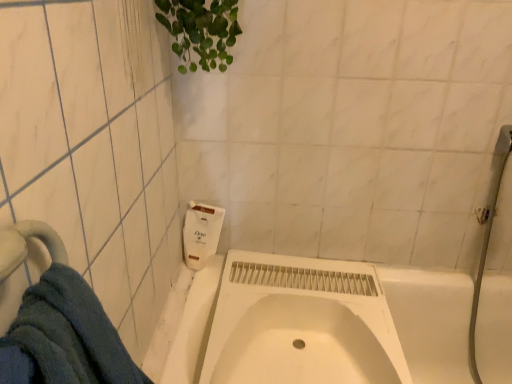
Question: Is white matte soap dispenser at upper center aimed at white matte bathtub at center?

Choices:
 (A) no
 (B) yes

Answer: (A)

Question: Considering the relative sizes of white matte soap dispenser at upper center and white matte bathtub at center in the image provided, is white matte soap dispenser at upper center taller than white matte bathtub at center?

Choices:
 (A) yes
 (B) no

Answer: (B)

Question: Is white matte soap dispenser at upper center completely or partially outside of white matte bathtub at center?

Choices:
 (A) yes
 (B) no

Answer: (A)

Question: From the image's perspective, is white matte soap dispenser at upper center located above white matte bathtub at center?

Choices:
 (A) no
 (B) yes

Answer: (B)

Question: Considering the relative positions of white matte soap dispenser at upper center and white matte bathtub at center in the image provided, is white matte soap dispenser at upper center in front of white matte bathtub at center?

Choices:
 (A) yes
 (B) no

Answer: (B)

Question: Is white matte bathtub at center surrounded by white matte soap dispenser at upper center?

Choices:
 (A) no
 (B) yes

Answer: (A)

Question: Is white matte bathtub at center positioned in front of white matte soap dispenser at upper center?

Choices:
 (A) no
 (B) yes

Answer: (B)

Question: Can you confirm if white matte bathtub at center is positioned to the left of white matte soap dispenser at upper center?

Choices:
 (A) yes
 (B) no

Answer: (B)

Question: Considering the relative sizes of white matte bathtub at center and white matte soap dispenser at upper center in the image provided, is white matte bathtub at center thinner than white matte soap dispenser at upper center?

Choices:
 (A) yes
 (B) no

Answer: (B)

Question: Does white matte bathtub at center lie behind white matte soap dispenser at upper center?

Choices:
 (A) yes
 (B) no

Answer: (B)

Question: Is white matte bathtub at center looking in the opposite direction of white matte soap dispenser at upper center?

Choices:
 (A) no
 (B) yes

Answer: (A)

Question: Does white matte bathtub at center touch white matte soap dispenser at upper center?

Choices:
 (A) yes
 (B) no

Answer: (B)

Question: Can you confirm if white matte sink at center is bigger than white matte bathtub at center?

Choices:
 (A) yes
 (B) no

Answer: (B)